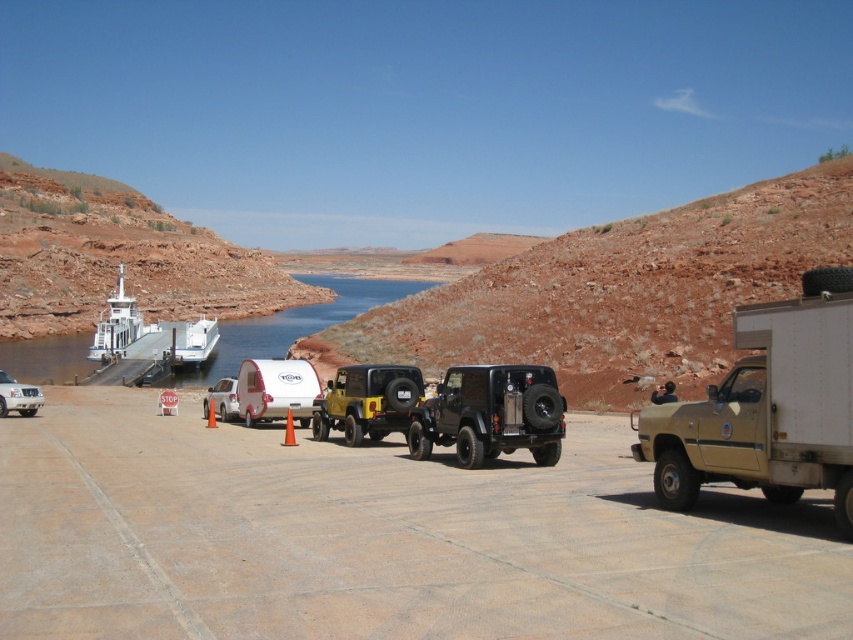
Question: Among these objects, which one is nearest to the camera?

Choices:
 (A) matte black jeep at center
 (B) white matte boat at left

Answer: (A)

Question: Does tan matte truck at right have a lesser width compared to yellow matte jeep at center?

Choices:
 (A) yes
 (B) no

Answer: (B)

Question: Does white matte camper at center have a smaller size compared to white matte boat at center?

Choices:
 (A) yes
 (B) no

Answer: (A)

Question: Which object appears closest to the camera in this image?

Choices:
 (A) tan matte truck at right
 (B) silver metallic suv at left

Answer: (A)

Question: In this image, where is white matte camper at center located relative to silver metallic suv at left?

Choices:
 (A) below
 (B) above

Answer: (B)

Question: Estimate the real-world distances between objects in this image. Which object is closer to the silver metallic suv at left?

Choices:
 (A) white matte boat at left
 (B) tan matte truck at right
 (C) white matte boat at center
 (D) yellow matte jeep at center

Answer: (D)